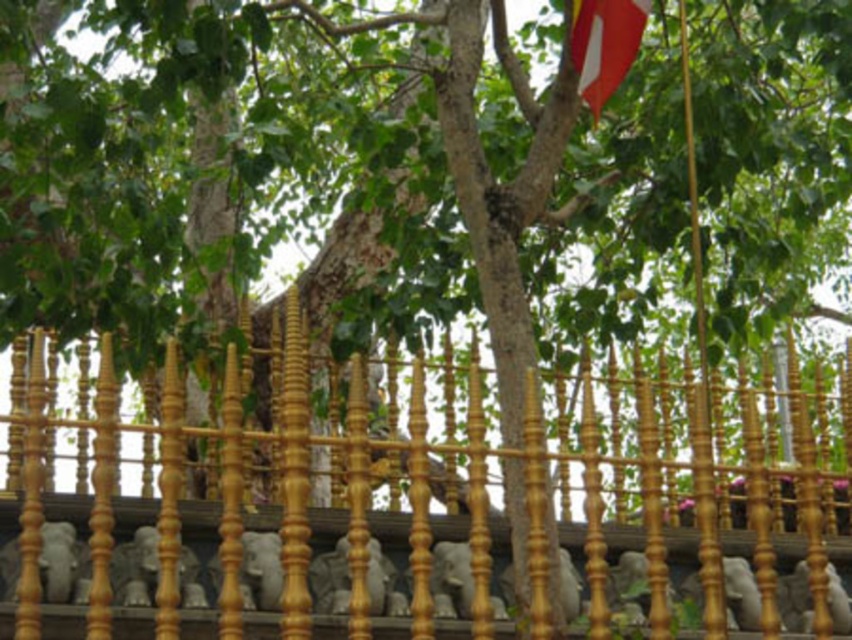
You are standing in a garden and see the gold polished fence at center and the red fabric flag at upper right. Which object is closer to you?

The gold polished fence at center is closer to you because it is in front of the red fabric flag at upper right.

You are standing in front of the gold polished fence at center and the red fabric flag at upper right. Which object is taller?

The gold polished fence at center is much taller than the red fabric flag at upper right.